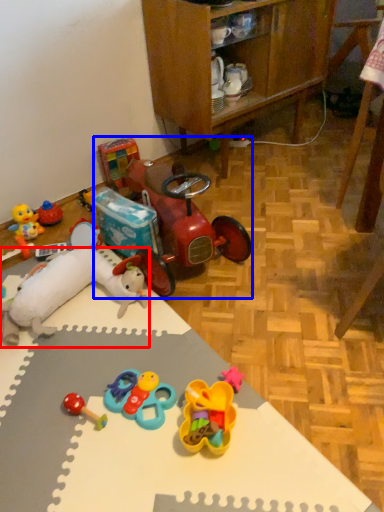
Question: Which point is closer to the camera, toy (highlighted by a red box) or toy car (highlighted by a blue box)?

Choices:
 (A) toy
 (B) toy car

Answer: (A)